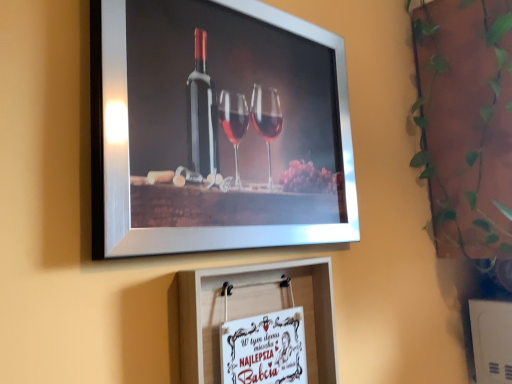
Question: Should I look upward or downward to see green leafy plant at upper right?

Choices:
 (A) down
 (B) up

Answer: (B)

Question: From a real-world perspective, is metallic silver picture frame at upper center, placed as the second picture frame when sorted from bottom to top, beneath white paper at center, placed as the 1th picture frame when sorted from bottom to top?

Choices:
 (A) yes
 (B) no

Answer: (B)

Question: Can you see metallic silver picture frame at upper center, placed as the second picture frame when sorted from bottom to top, touching white paper at center, arranged as the 2th picture frame when viewed from the top?

Choices:
 (A) yes
 (B) no

Answer: (B)

Question: Are metallic silver picture frame at upper center, placed as the second picture frame when sorted from bottom to top, and white paper at center, arranged as the 2th picture frame when viewed from the top, located far from each other?

Choices:
 (A) no
 (B) yes

Answer: (A)

Question: Is metallic silver picture frame at upper center, placed as the second picture frame when sorted from bottom to top, completely or partially outside of white paper at center, placed as the 1th picture frame when sorted from bottom to top?

Choices:
 (A) yes
 (B) no

Answer: (A)

Question: Is metallic silver picture frame at upper center, placed as the second picture frame when sorted from bottom to top, positioned before white paper at center, arranged as the 2th picture frame when viewed from the top?

Choices:
 (A) yes
 (B) no

Answer: (A)

Question: Considering the relative sizes of metallic silver picture frame at upper center, the 1th picture frame from the top, and white paper at center, arranged as the 2th picture frame when viewed from the top, in the image provided, is metallic silver picture frame at upper center, the 1th picture frame from the top, wider than white paper at center, arranged as the 2th picture frame when viewed from the top,?

Choices:
 (A) no
 (B) yes

Answer: (A)

Question: Is there a large distance between white paper at center, placed as the 1th picture frame when sorted from bottom to top, and green leafy plant at upper right?

Choices:
 (A) yes
 (B) no

Answer: (B)

Question: Can you confirm if white paper at center, arranged as the 2th picture frame when viewed from the top, is positioned to the left of green leafy plant at upper right?

Choices:
 (A) no
 (B) yes

Answer: (B)

Question: Considering the relative positions of white paper at center, placed as the 1th picture frame when sorted from bottom to top, and green leafy plant at upper right in the image provided, is white paper at center, placed as the 1th picture frame when sorted from bottom to top, to the right of green leafy plant at upper right from the viewer's perspective?

Choices:
 (A) no
 (B) yes

Answer: (A)

Question: From the image's perspective, is white paper at center, arranged as the 2th picture frame when viewed from the top, beneath green leafy plant at upper right?

Choices:
 (A) yes
 (B) no

Answer: (A)

Question: Is white paper at center, arranged as the 2th picture frame when viewed from the top, bigger than green leafy plant at upper right?

Choices:
 (A) no
 (B) yes

Answer: (A)

Question: Does white paper at center, placed as the 1th picture frame when sorted from bottom to top, have a smaller size compared to green leafy plant at upper right?

Choices:
 (A) yes
 (B) no

Answer: (A)

Question: Can you confirm if white paper at center, placed as the 1th picture frame when sorted from bottom to top, is taller than metallic silver picture frame at upper center, placed as the second picture frame when sorted from bottom to top?

Choices:
 (A) yes
 (B) no

Answer: (B)